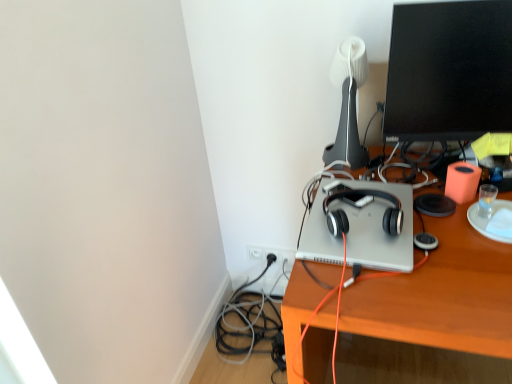
I want to click on free space in front of satin black headphones at center, so 373,249.